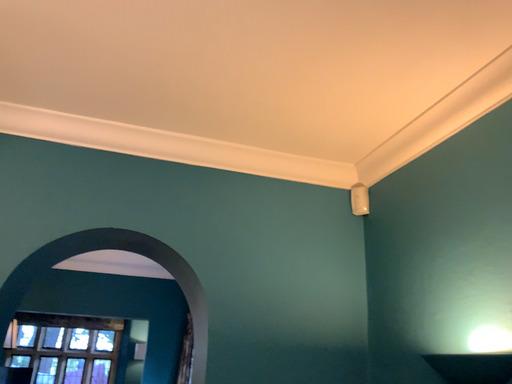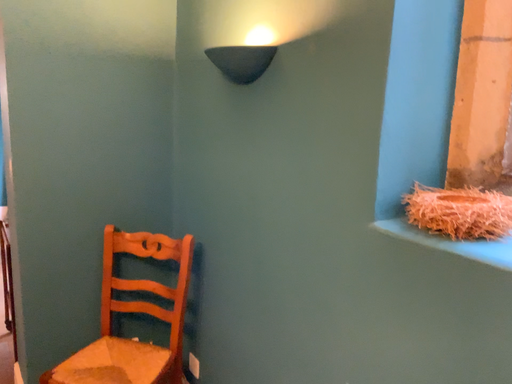
Question: How did the camera likely rotate when shooting the video?

Choices:
 (A) rotated upward
 (B) rotated downward

Answer: (B)